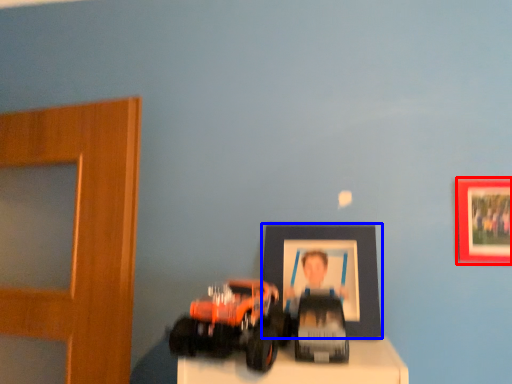
Question: Among these objects, which one is nearest to the camera, picture frame (highlighted by a red box) or picture frame (highlighted by a blue box)?

Choices:
 (A) picture frame
 (B) picture frame

Answer: (A)